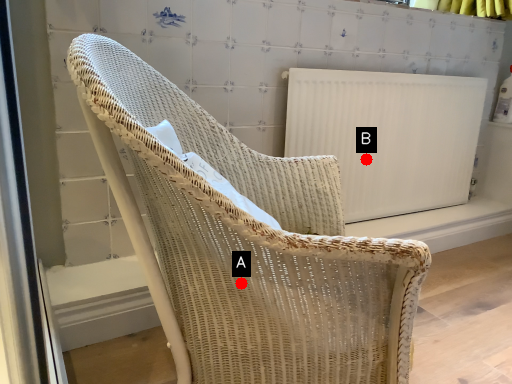
Question: Two points are circled on the image, labeled by A and B beside each circle. Among these points, which one is farthest from the camera?

Choices:
 (A) A is further
 (B) B is further

Answer: (B)